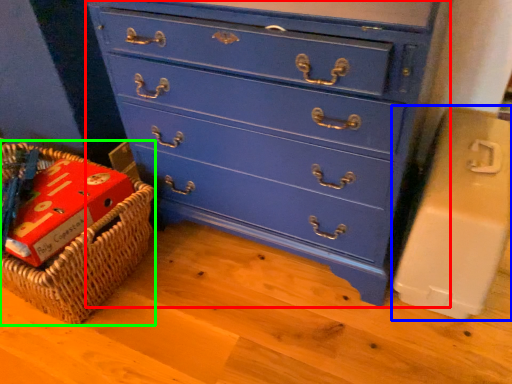
Question: Which is nearer to the chest of drawers (highlighted by a red box)? cardboard box (highlighted by a blue box) or basket (highlighted by a green box).

Choices:
 (A) cardboard box
 (B) basket

Answer: (A)